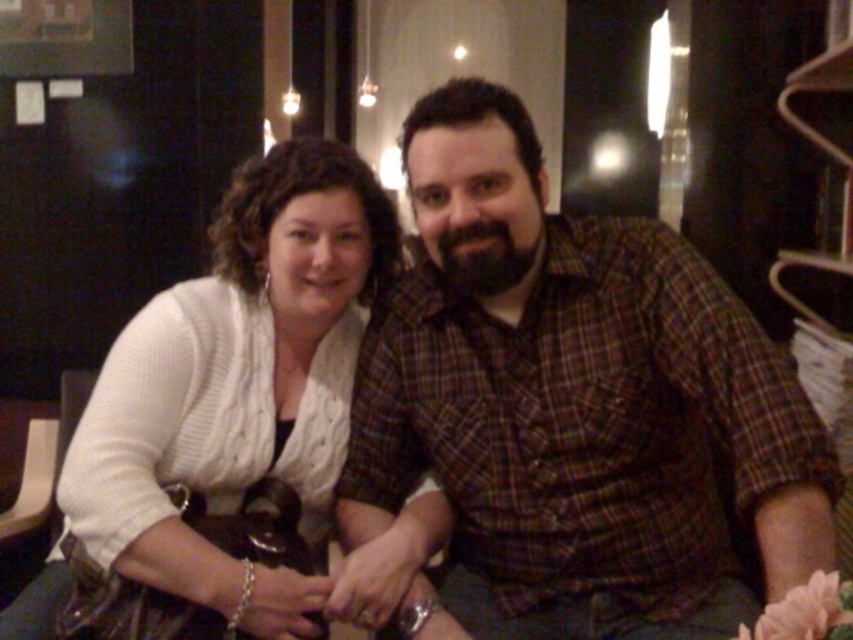
Question: Observing the image, what is the correct spatial positioning of plaid shirt at center in reference to white knitted sweater at center?

Choices:
 (A) above
 (B) below

Answer: (A)

Question: Is plaid shirt at center further to the viewer compared to white knitted sweater at center?

Choices:
 (A) no
 (B) yes

Answer: (A)

Question: Does plaid shirt at center have a smaller size compared to white knitted sweater at center?

Choices:
 (A) yes
 (B) no

Answer: (B)

Question: Which point appears farthest from the camera in this image?

Choices:
 (A) (300, 432)
 (B) (508, 387)

Answer: (A)